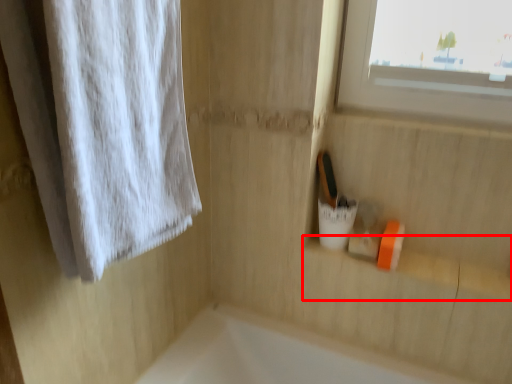
Question: From the image, what is the correct spatial relationship of window sill (annotated by the red box) in relation to curtain?

Choices:
 (A) right
 (B) left

Answer: (A)